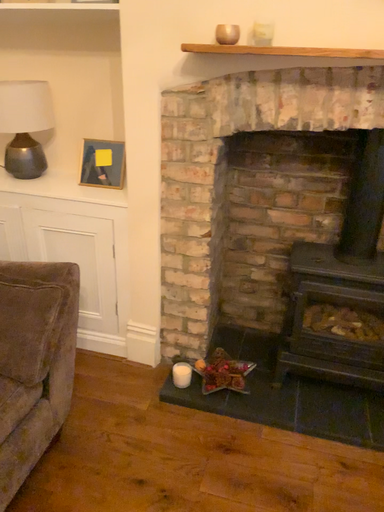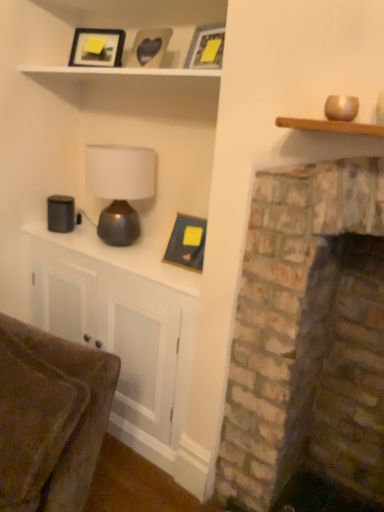
Question: Which way did the camera rotate in the video?

Choices:
 (A) rotated upward
 (B) rotated downward

Answer: (A)